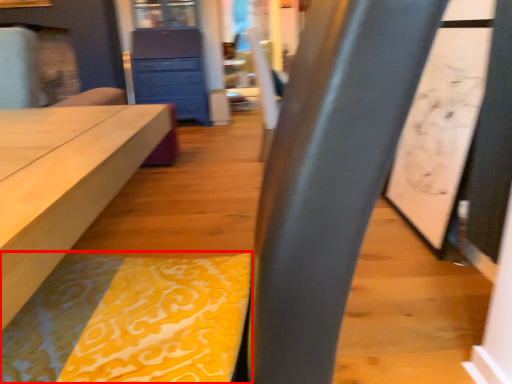
Question: Where is blanket (annotated by the red box) located in relation to chest of drawers in the image?

Choices:
 (A) right
 (B) left

Answer: (A)